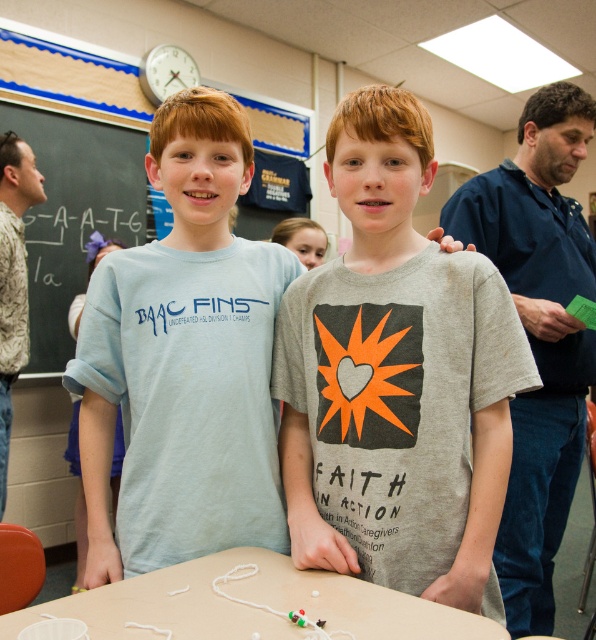
Question: Is light blue cotton shirt at center above wooden table at center?

Choices:
 (A) no
 (B) yes

Answer: (B)

Question: Can you confirm if gray matte t-shirt at center is bigger than black chalkboard at upper left?

Choices:
 (A) no
 (B) yes

Answer: (A)

Question: Which point is farther to the camera?

Choices:
 (A) (389, 636)
 (B) (523, 404)
 (C) (436, 563)

Answer: (B)

Question: Which point appears closest to the camera in this image?

Choices:
 (A) (129, 163)
 (B) (197, 592)
 (C) (126, 467)
 (D) (474, 396)

Answer: (B)

Question: In this image, where is wooden table at center located relative to black chalkboard at upper left?

Choices:
 (A) above
 (B) below

Answer: (B)

Question: Based on their relative distances, which object is nearer to the black chalkboard at upper left?

Choices:
 (A) light blue cotton shirt at center
 (B) wooden table at center
 (C) gray cotton shirt at right
 (D) gray matte t-shirt at center

Answer: (A)